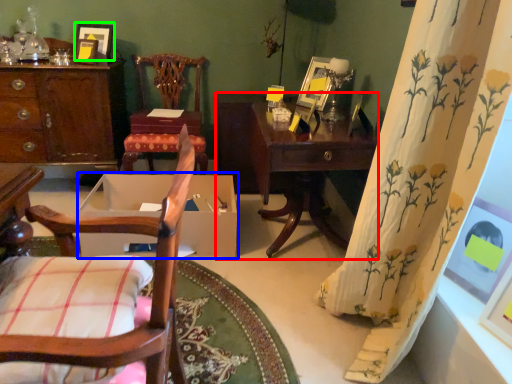
Question: Considering the real-world distances, which object is closest to table (highlighted by a red box)? cardboard box (highlighted by a blue box) or picture frame (highlighted by a green box).

Choices:
 (A) cardboard box
 (B) picture frame

Answer: (A)